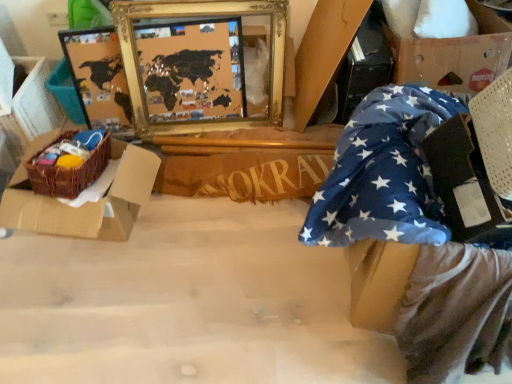
Where is `free space to the left of wooden sign at center`? The height and width of the screenshot is (384, 512). free space to the left of wooden sign at center is located at coordinates (168, 218).